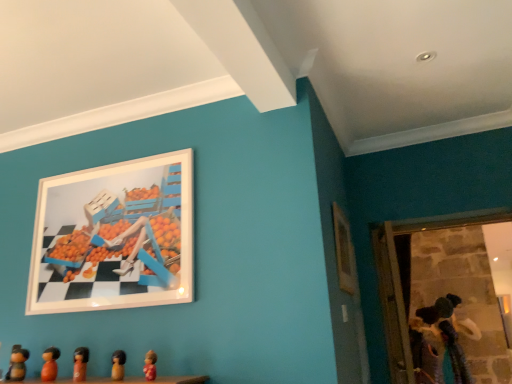
Locate an element on the screen. Image resolution: width=512 pixels, height=384 pixels. free spot above white glossy picture frame at upper left, the second picture frame from the right (from a real-world perspective) is located at coordinates (112, 163).